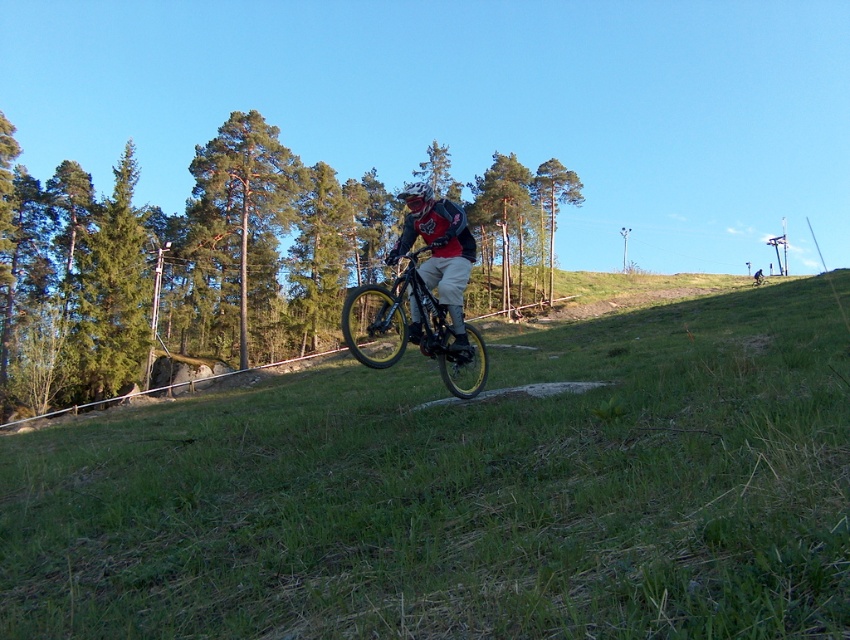
You are standing at the point where the mountain biker is currently positioned. You want to throw a small pebble towards the point marked at coordinates (440, 365). If your throwing range is up to 5 meters, will you be able to reach that point with your throw?

The distance of point (440, 365) from viewer is 5.26 meters, which is beyond your throwing range of 5 meters. Therefore, you cannot reach that point with your throw.

You are a photographer planning to capture the mountain biker midair. You notice the green grassy at center and the matte black helmet at center in your viewfinder. Which object should you focus on if you want to capture the wider subject?

The green grassy at center is wider than the matte black helmet at center, so you should focus on the green grassy at center to capture the wider subject.